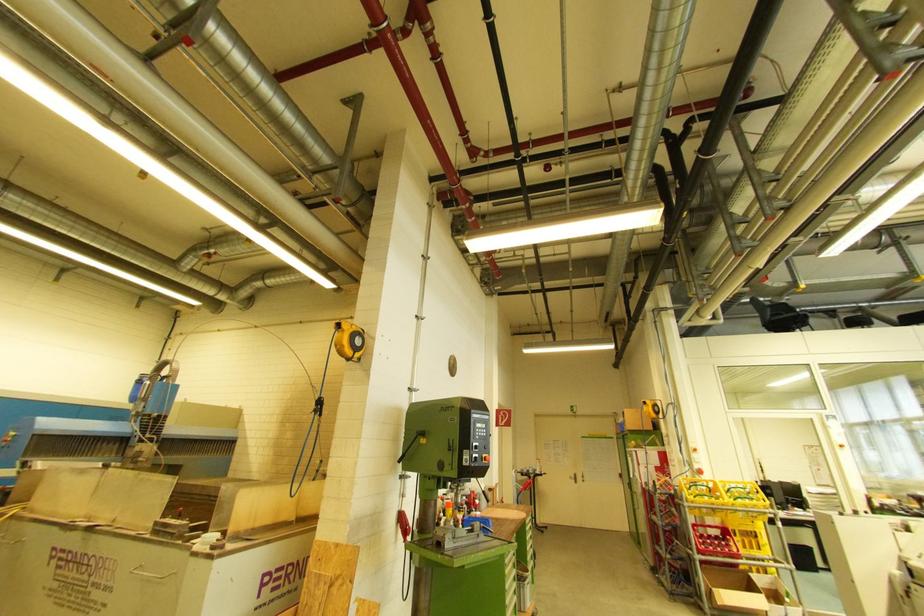
This screenshot has height=616, width=924. Describe the element at coordinates (404, 525) in the screenshot. I see `the vise handle` at that location.